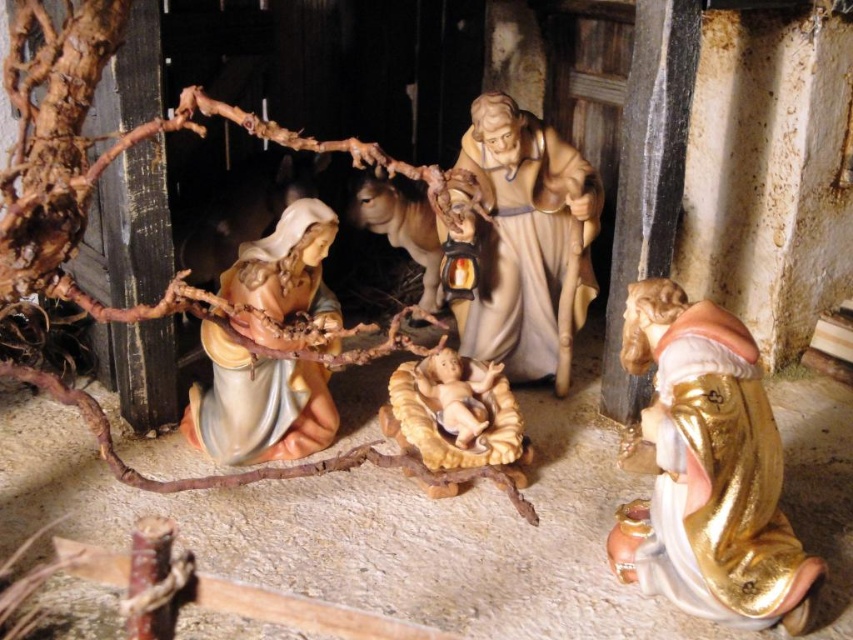
Question: Does gold glossy statue at lower right have a lesser width compared to smooth beige baby at center?

Choices:
 (A) yes
 (B) no

Answer: (B)

Question: Which object is the closest to the matte wood figure at center?

Choices:
 (A) matte beige statue at center
 (B) gold glossy statue at lower right

Answer: (A)

Question: Based on their relative distances, which object is nearer to the smooth beige baby at center?

Choices:
 (A) gold glossy statue at lower right
 (B) matte beige statue at center

Answer: (B)

Question: Is gold glossy statue at lower right below matte beige statue at center?

Choices:
 (A) no
 (B) yes

Answer: (B)

Question: Which point is closer to the camera?

Choices:
 (A) matte beige statue at center
 (B) smooth beige baby at center

Answer: (A)

Question: Is matte wood figure at center above matte beige statue at center?

Choices:
 (A) yes
 (B) no

Answer: (A)